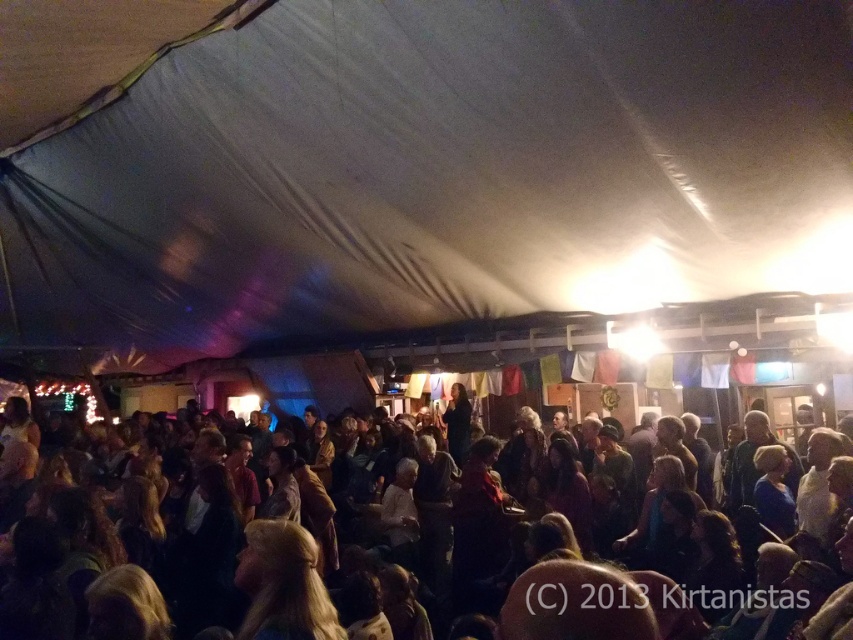
Between point (776, 288) and point (422, 572), which one is positioned in front?

Positioned in front is point (776, 288).

Does white fabric tent at center have a greater width compared to dark brown hair at lower center?

Yes, white fabric tent at center is wider than dark brown hair at lower center.

Who is more forward, (790,3) or (566,456)?

Point (790,3)

The image size is (853, 640). In order to click on white fabric tent at center in this screenshot , I will do `click(409, 166)`.